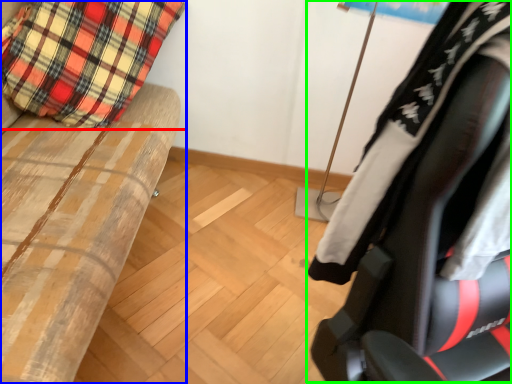
Question: Which object is positioned closest to pillow (highlighted by a red box)? Select from furniture (highlighted by a blue box) and chair (highlighted by a green box).

Choices:
 (A) furniture
 (B) chair

Answer: (A)